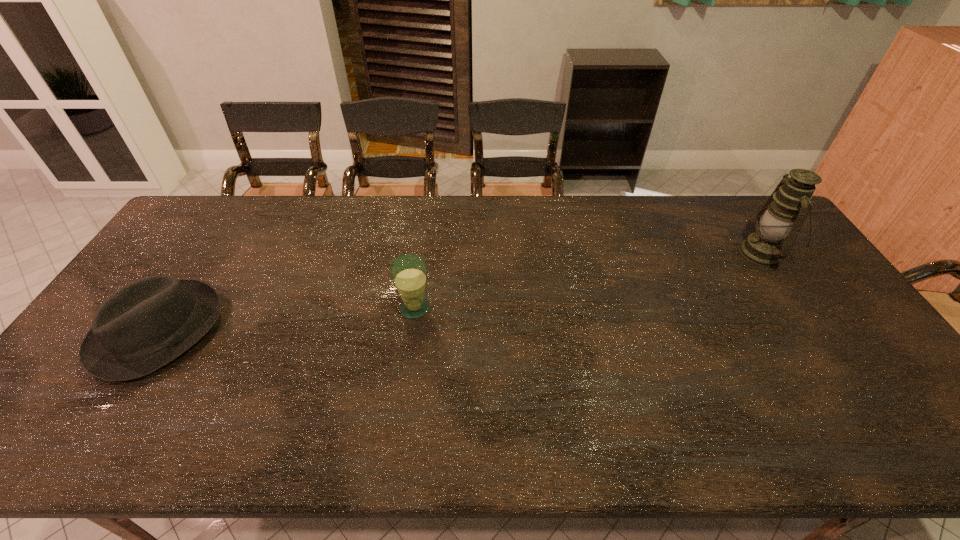
This screenshot has width=960, height=540. I want to click on free space that satisfies the following two spatial constraints: 1. on the back side of the leftmost object; 2. on the right side of the glass, so click(173, 308).

Locate an element on the screen. vacant region that satisfies the following two spatial constraints: 1. on the back side of the rightmost object; 2. on the right side of the second object from right to left is located at coordinates point(422,253).

Where is `vacant space that satisfies the following two spatial constraints: 1. on the back side of the second object from left to right; 2. on the right side of the shortest object`? This screenshot has height=540, width=960. vacant space that satisfies the following two spatial constraints: 1. on the back side of the second object from left to right; 2. on the right side of the shortest object is located at coordinates (173, 308).

You are a GUI agent. You are given a task and a screenshot of the screen. Output one action in this format:
    pyautogui.click(x=<x>, y=<y>)
    Task: Click on the free space that satisfies the following two spatial constraints: 1. on the back side of the oil lamp; 2. on the left side of the second tallest object
    This screenshot has width=960, height=540.
    Given the screenshot: What is the action you would take?
    pyautogui.click(x=422, y=253)